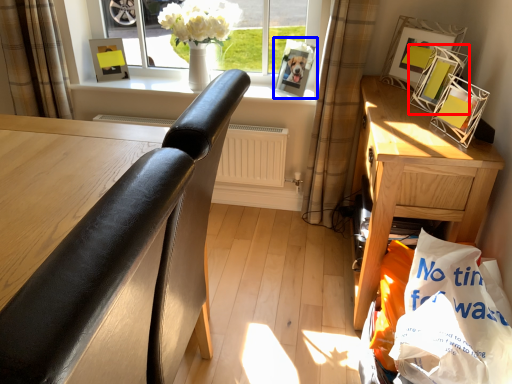
Question: Which object is closer to the camera taking this photo, picture frame (highlighted by a red box) or picture frame (highlighted by a blue box)?

Choices:
 (A) picture frame
 (B) picture frame

Answer: (A)